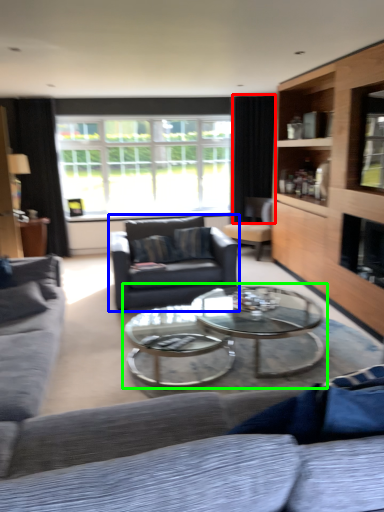
Question: Based on their relative distances, which object is farther from curtain (highlighted by a red box)? Choose from swivel chair (highlighted by a blue box) and coffee table (highlighted by a green box).

Choices:
 (A) swivel chair
 (B) coffee table

Answer: (B)